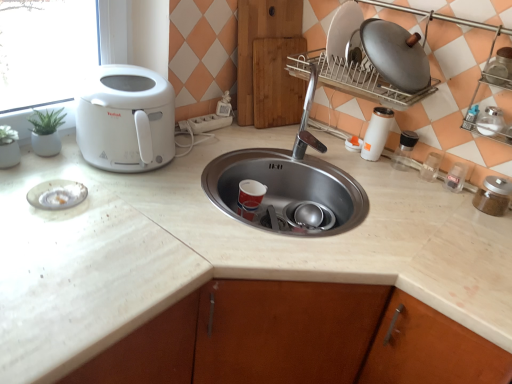
Locate an element on the screen. Image resolution: width=512 pixels, height=384 pixels. vacant point to the left of clear plastic container at right, which is the 4th appliance from right to left is located at coordinates (404, 181).